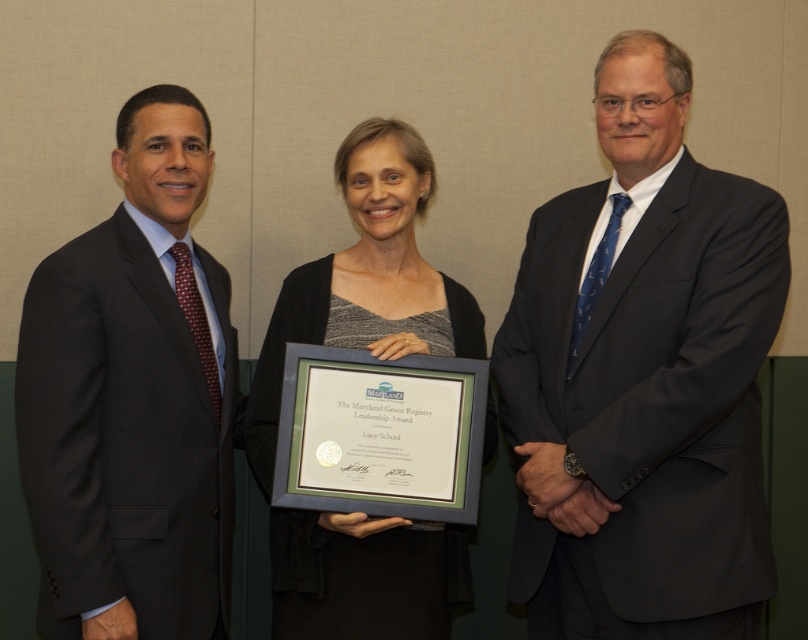
Looking at this image, who is positioned more to the left, dark gray suit at center or dark gray pinstripe suit at left?

From the viewer's perspective, dark gray pinstripe suit at left appears more on the left side.

Is point (621, 589) positioned before point (204, 588)?

Yes, it is.

This screenshot has width=808, height=640. What are the coordinates of `dark gray suit at center` in the screenshot? It's located at (642, 378).

Who is shorter, dark gray suit at center or gray matte/black textured dress at center?

Standing shorter between the two is gray matte/black textured dress at center.

Is dark gray suit at center in front of gray matte/black textured dress at center?

Yes, it is in front of gray matte/black textured dress at center.

Who is more distant from viewer, (754,422) or (444,630)?

The point (444,630) is more distant.

The width and height of the screenshot is (808, 640). Identify the location of dark gray suit at center. (642, 378).

Where is `dark gray pinstripe suit at left`? Image resolution: width=808 pixels, height=640 pixels. dark gray pinstripe suit at left is located at coordinates (133, 397).

Locate an element on the screen. The image size is (808, 640). dark gray pinstripe suit at left is located at coordinates (133, 397).